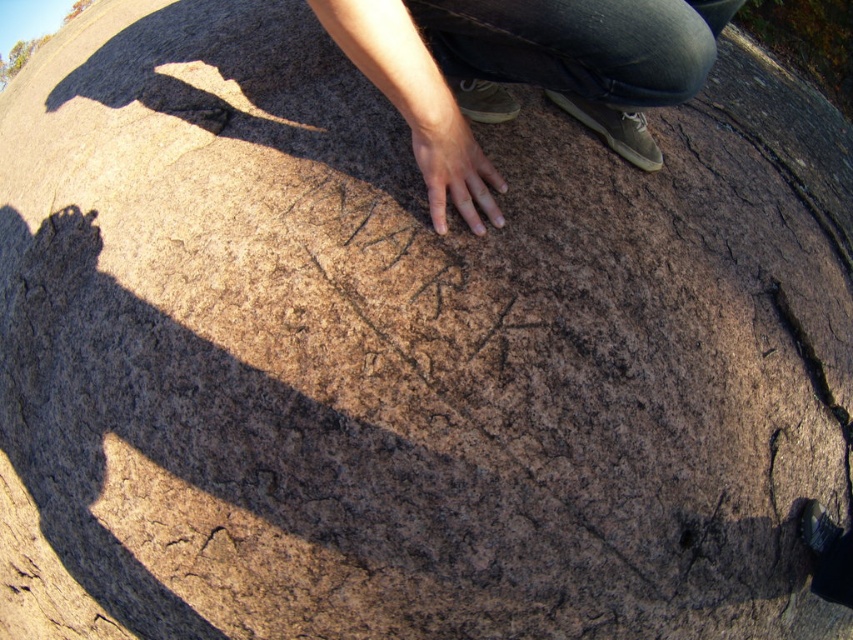
Question: Is smooth tan skin at center behind smooth brown hand at center?

Choices:
 (A) yes
 (B) no

Answer: (B)

Question: Can you confirm if smooth tan skin at center is wider than smooth brown hand at center?

Choices:
 (A) no
 (B) yes

Answer: (B)

Question: Among these points, which one is farthest from the camera?

Choices:
 (A) (500, 61)
 (B) (479, 177)

Answer: (B)

Question: Is smooth tan skin at center below smooth brown hand at center?

Choices:
 (A) yes
 (B) no

Answer: (B)